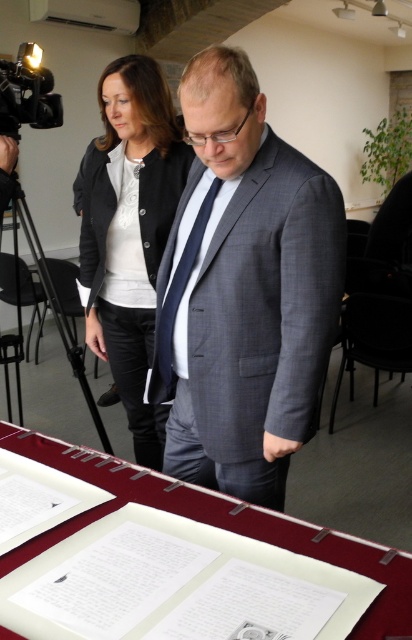
You are standing in the room and want to move from the point at coordinates point (x=123, y=499) to the point at coordinates point (x=191, y=234). Which direction should you face to move towards the second point?

To move from point (x=123, y=499) to point (x=191, y=234), you should face towards the northwest direction since point (x=191, y=234) is located to the northwest of point (x=123, y=499).

You are a photographer at the event and need to adjust the lighting so that both the gray textured suit at center and the matte black blazer at center are evenly illuminated. Since the camera is already focused on the center, where should you position the light source relative to the two people?

To ensure both the gray textured suit at center and the matte black blazer at center are evenly lit, position the light source to the left of the matte black blazer at center. This way, the light will reach both individuals effectively since the gray textured suit at center is to the right of the matte black blazer at center.